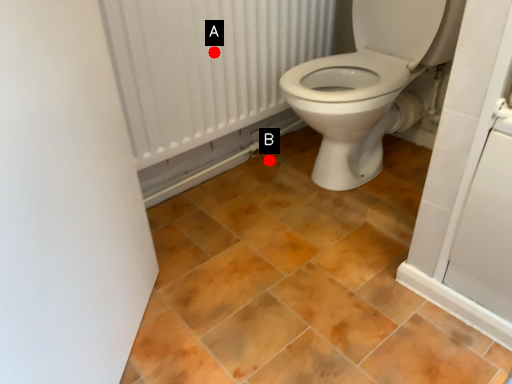
Question: Two points are circled on the image, labeled by A and B beside each circle. Which point is closer to the camera taking this photo?

Choices:
 (A) A is closer
 (B) B is closer

Answer: (A)